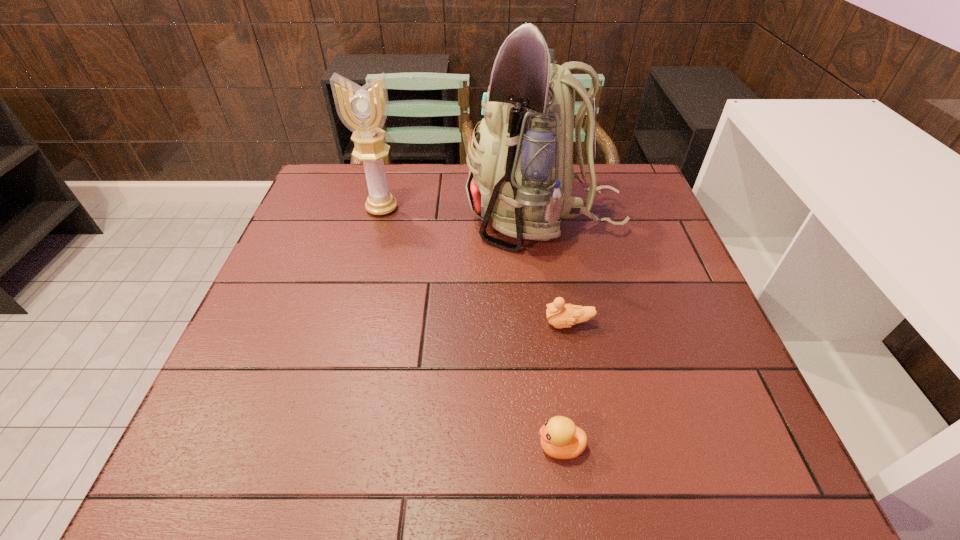
Locate an element on the screen. Image resolution: width=960 pixels, height=540 pixels. the tallest object is located at coordinates (520, 172).

Identify the location of award. Image resolution: width=960 pixels, height=540 pixels. (363, 110).

Locate an element on the screen. The height and width of the screenshot is (540, 960). the third shortest object is located at coordinates (363, 110).

Image resolution: width=960 pixels, height=540 pixels. I want to click on the nearer duckling, so click(560, 438).

This screenshot has width=960, height=540. Find the location of `the second nearest object`. the second nearest object is located at coordinates (560, 315).

Identify the location of vacant region located 0.330m on the front-facing side of the backpack. Image resolution: width=960 pixels, height=540 pixels. (346, 218).

Image resolution: width=960 pixels, height=540 pixels. Find the location of `vacant point located 0.220m on the front-facing side of the backpack`. vacant point located 0.220m on the front-facing side of the backpack is located at coordinates coord(386,218).

Where is `vacant space located 0.120m on the front-facing side of the backpack`? This screenshot has width=960, height=540. vacant space located 0.120m on the front-facing side of the backpack is located at coordinates (422, 218).

Where is `vacant space located on the front-facing side of the third shortest object`? The height and width of the screenshot is (540, 960). vacant space located on the front-facing side of the third shortest object is located at coordinates (373, 240).

Where is `vacant space located on the face of the nearest object`? The width and height of the screenshot is (960, 540). vacant space located on the face of the nearest object is located at coordinates (372, 447).